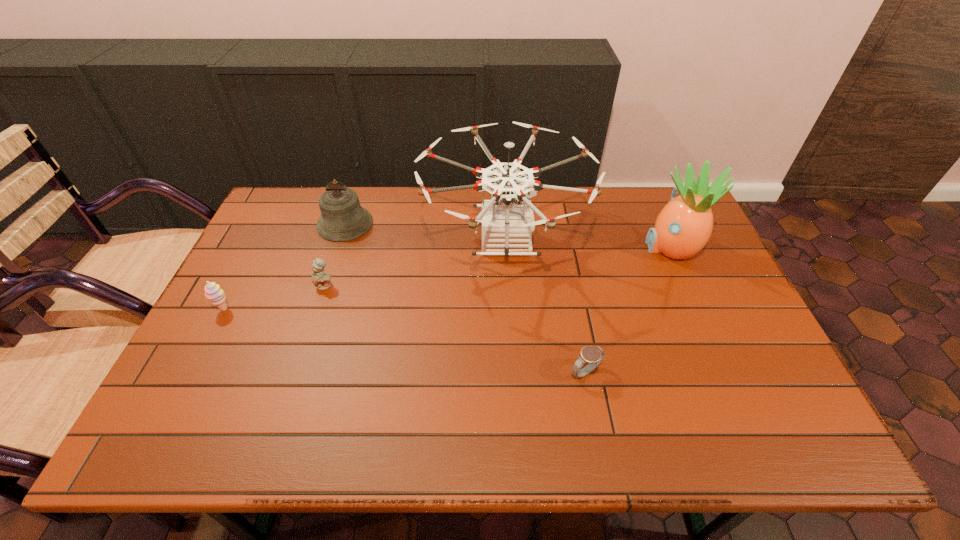
The width and height of the screenshot is (960, 540). In order to click on object that is at the right edge in this screenshot , I will do `click(682, 229)`.

Locate an element on the screen. This screenshot has width=960, height=540. object positioned at the far right corner is located at coordinates (682, 229).

In the image, there is a desktop. Where is `vacant space at the far edge`? The image size is (960, 540). vacant space at the far edge is located at coordinates (444, 221).

The width and height of the screenshot is (960, 540). Find the location of `free location at the near edge`. free location at the near edge is located at coordinates (382, 441).

Locate an element on the screen. The height and width of the screenshot is (540, 960). vacant space at the left edge of the desktop is located at coordinates (207, 329).

In the image, there is a desktop. Identify the location of free space at the right edge. (715, 336).

The image size is (960, 540). I want to click on vacant region at the far right corner, so click(x=645, y=210).

Where is `free spot between the watch and the drone`? Image resolution: width=960 pixels, height=540 pixels. free spot between the watch and the drone is located at coordinates (544, 308).

The width and height of the screenshot is (960, 540). What are the coordinates of `free space between the drone and the teddy bear` in the screenshot? It's located at (415, 265).

Identify the location of blank region between the teddy bear and the leftmost object. Image resolution: width=960 pixels, height=540 pixels. (275, 298).